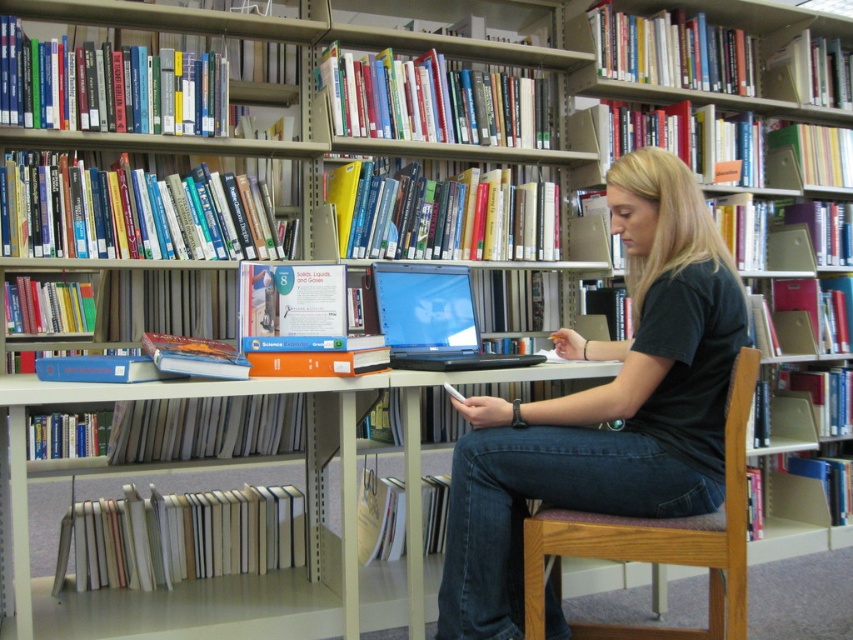
You are a delivery robot that needs to place a small package between the black cotton shirt at center and the wooden chair at center. The package is 6 inches long. Can it fit in the space between them?

The space between the black cotton shirt at center and the wooden chair at center is 6.60 inches. Since the package is 6 inches long, it can fit in the space between them.

In the scene shown: You are a photographer who needs to take a photo of the black cotton shirt at center. The camera is 1.69 meters away. Can you take the photo without moving the camera or the shirt?

Yes, the black cotton shirt at center and camera are 1.69 meters apart, so the photographer can take the photo without moving either since most cameras can focus at that distance.

You are standing in the library and want to sit down on the wooden chair at center. However, you notice the black cotton shirt at center is in the way. Can you sit down without moving the shirt?

The black cotton shirt at center is further to the viewer than wooden chair at center, meaning the shirt is closer to you. Therefore, you would need to move the shirt to access the chair.